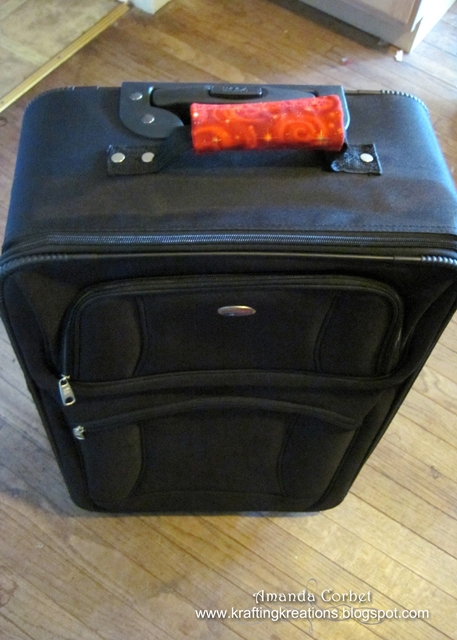
Where is `handle`? The image size is (457, 640). handle is located at coordinates (144, 115), (185, 100), (178, 141).